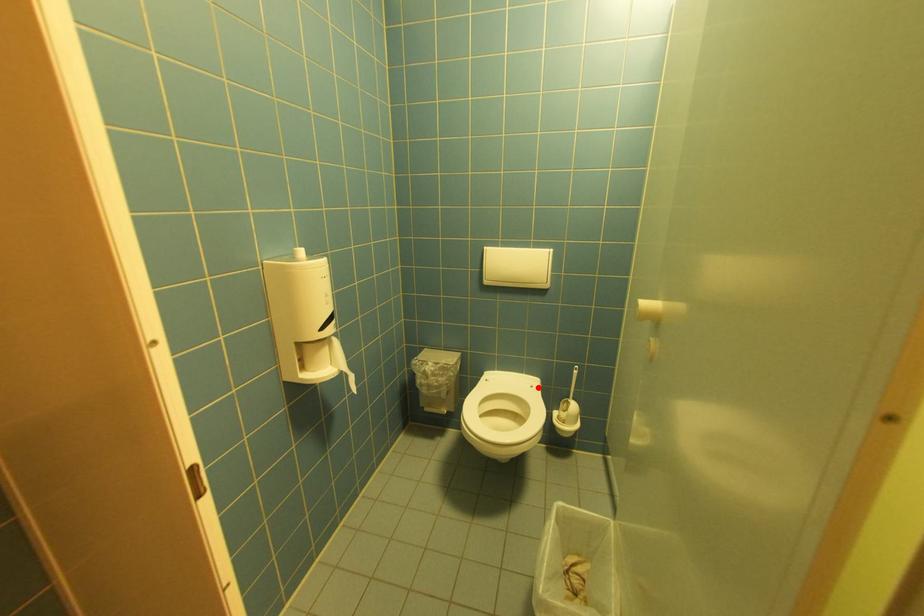
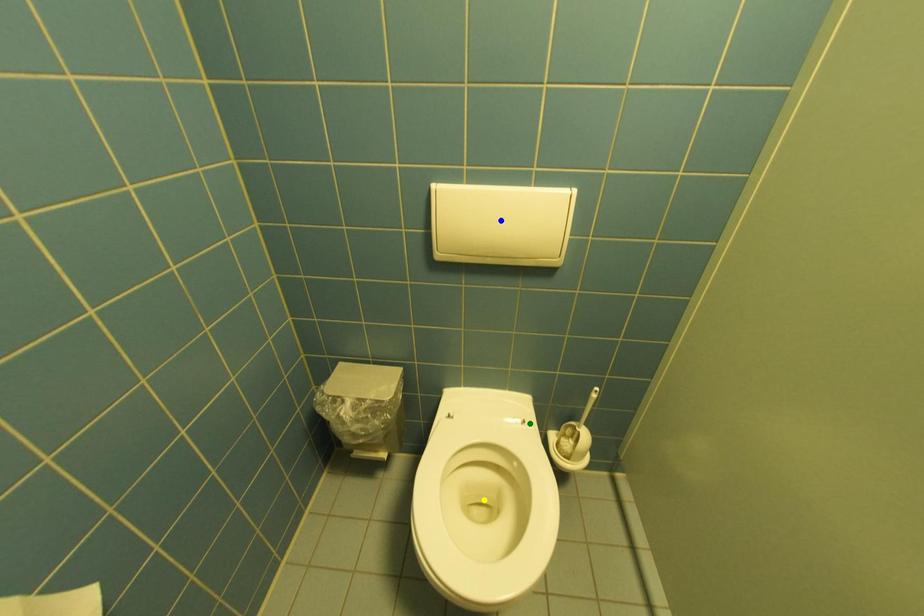
Question: I am providing you with two images of the same scene from different viewpoints. A red point is marked on the first image. You are given multiple points on the second image. Can you choose the point in image 2 that corresponds to the point in image 1?

Choices:
 (A) blue point
 (B) green point
 (C) yellow point

Answer: (B)